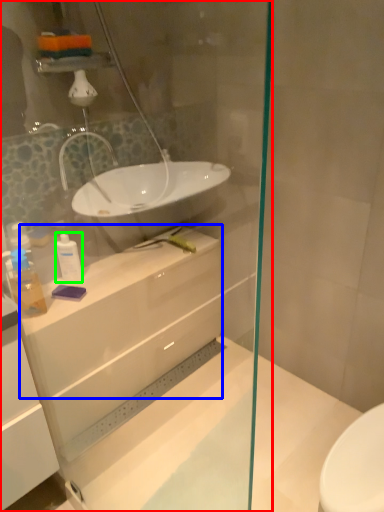
Question: Which is nearer to the shower door (highlighted by a red box)? counter top (highlighted by a blue box) or toiletry (highlighted by a green box).

Choices:
 (A) counter top
 (B) toiletry

Answer: (A)